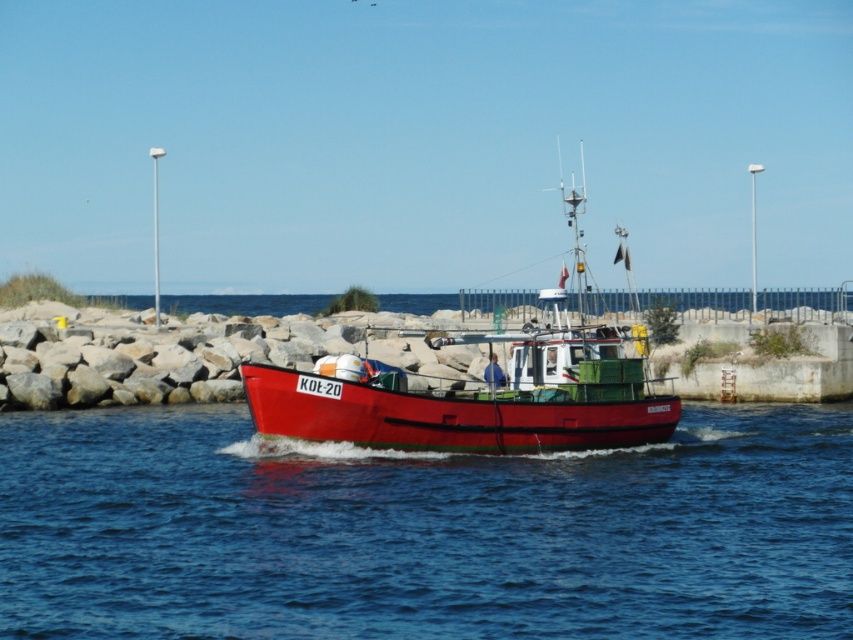
Does point (825, 497) come closer to viewer compared to point (549, 339)?

Yes, point (825, 497) is closer to viewer.

Who is lower down, blue water at center or shiny red boat at center?

blue water at center is lower down.

Which is behind, point (612, 500) or point (252, 410)?

The point (252, 410) is more distant.

At what (x,y) coordinates should I click in order to perform the action: click on blue water at center. Please return your answer as a coordinate pair (x, y). This screenshot has width=853, height=640. Looking at the image, I should click on (422, 531).